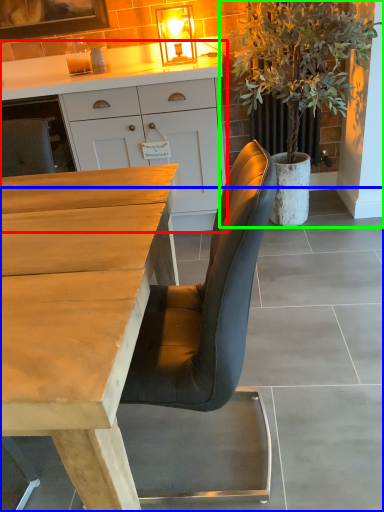
Question: Considering the real-world distances, which object is closest to cabinetry (highlighted by a red box)? concrete (highlighted by a blue box) or houseplant (highlighted by a green box).

Choices:
 (A) concrete
 (B) houseplant

Answer: (B)